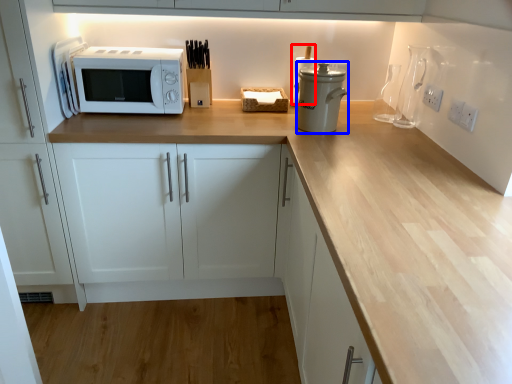
Question: Among these objects, which one is nearest to the camera, appliance (highlighted by a red box) or appliance (highlighted by a blue box)?

Choices:
 (A) appliance
 (B) appliance

Answer: (B)